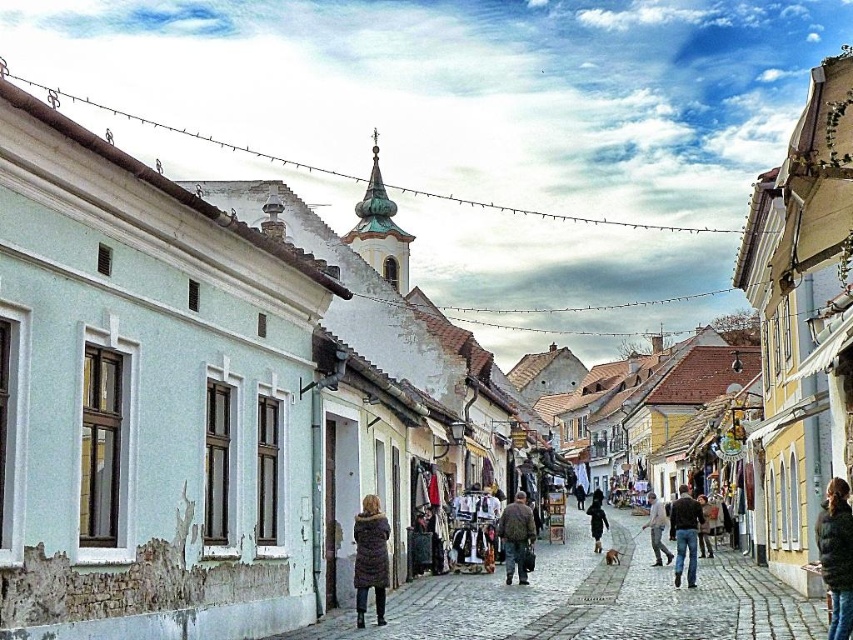
You are standing on a cobblestone street in a European town. There is a point marked at coordinates (x=714, y=557). If you want to walk towards this point, how far will you have to walk in meters?

The point at coordinates (x=714, y=557) is 92.15 meters away from the viewer, so you will have to walk 92.15 meters to reach it.

You are standing on the cobblestone street and want to pick up both the black fuzzy jacket at lower right and the jeans at center. Which item should you reach for first to grab the one closer to you?

The black fuzzy jacket at lower right is closer to the viewer, so you should reach for it first.